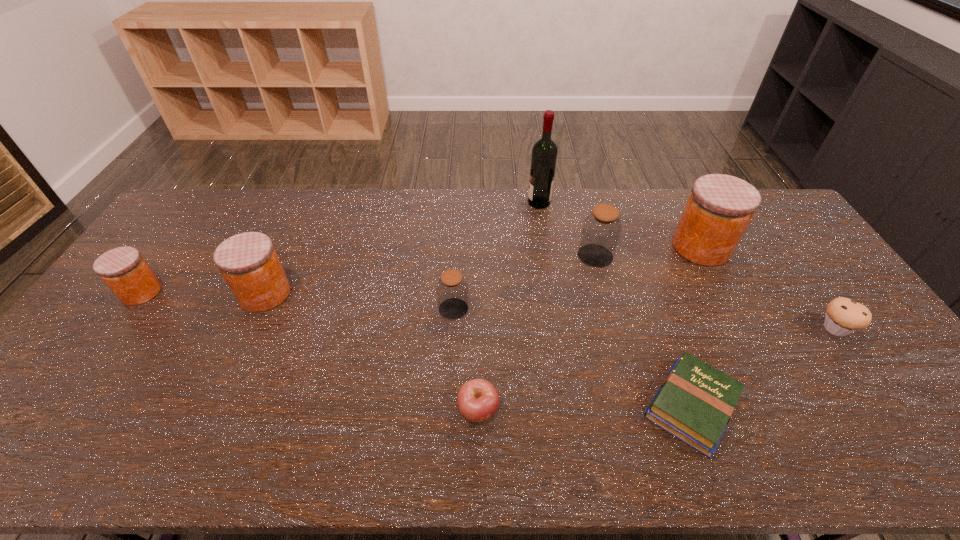
Locate an element on the screen. the smaller brown jar is located at coordinates (452, 290).

Where is `the nearer brown jar`? Image resolution: width=960 pixels, height=540 pixels. the nearer brown jar is located at coordinates (452, 290).

Find the location of a particular element. muffin is located at coordinates (844, 316).

At what (x,y) coordinates should I click in order to perform the action: click on apple. Please return your answer as a coordinate pair (x, y). The width and height of the screenshot is (960, 540). Looking at the image, I should click on (478, 400).

Identify the location of the shortest object. The height and width of the screenshot is (540, 960). (695, 402).

Locate an element on the screen. brown book is located at coordinates (695, 402).

At what (x,y) coordinates should I click in order to perform the action: click on free location located on the front and back of the alcohol. Please return your answer as a coordinate pair (x, y). The height and width of the screenshot is (540, 960). Looking at the image, I should click on (446, 202).

At what (x,y) coordinates should I click in order to perform the action: click on vacant point located on the front and back of the alcohol. Please return your answer as a coordinate pair (x, y). The height and width of the screenshot is (540, 960). Looking at the image, I should click on (514, 202).

You are a GUI agent. You are given a task and a screenshot of the screen. Output one action in this format:
    pyautogui.click(x=<x>, y=<y>)
    Task: Click on the vacant space located 0.370m on the front and back of the alcohol
    Image resolution: width=960 pixels, height=540 pixels.
    Given the screenshot: What is the action you would take?
    pyautogui.click(x=427, y=202)

Image resolution: width=960 pixels, height=540 pixels. I want to click on vacant space located 0.260m on the left of the eighth object from left to right, so click(593, 247).